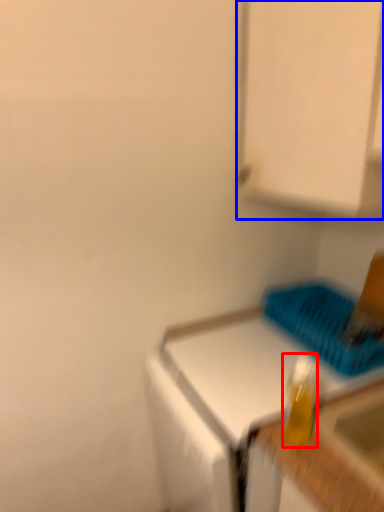
Question: Among these objects, which one is farthest to the camera, bottle (highlighted by a red box) or cabinetry (highlighted by a blue box)?

Choices:
 (A) bottle
 (B) cabinetry

Answer: (A)